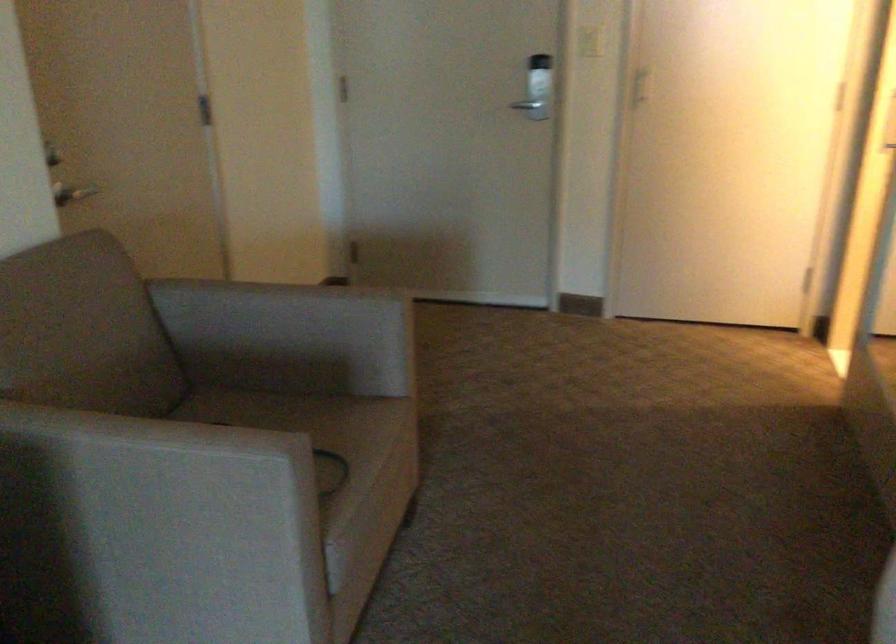
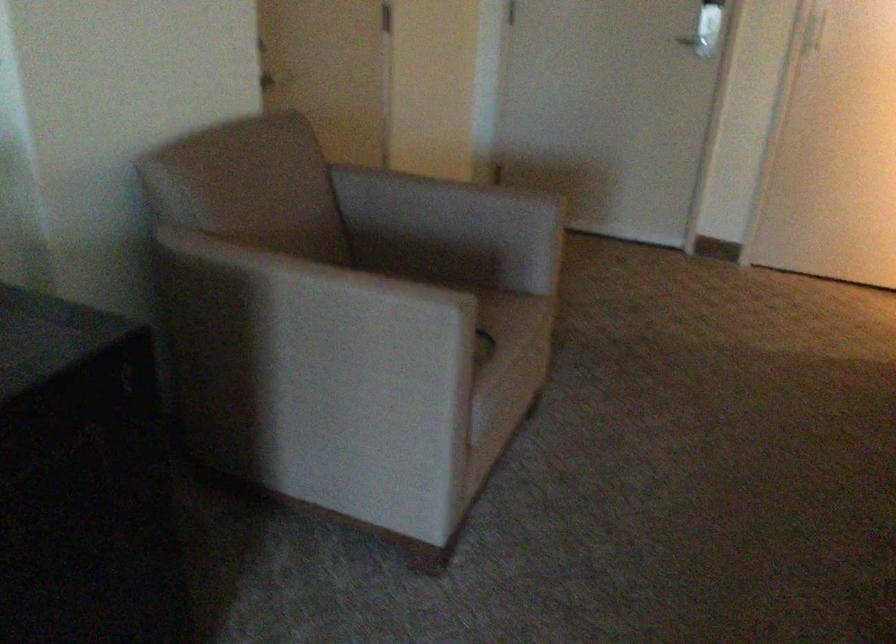
Find the pixel in the second image that matches point (524, 115) in the first image.

(694, 41)